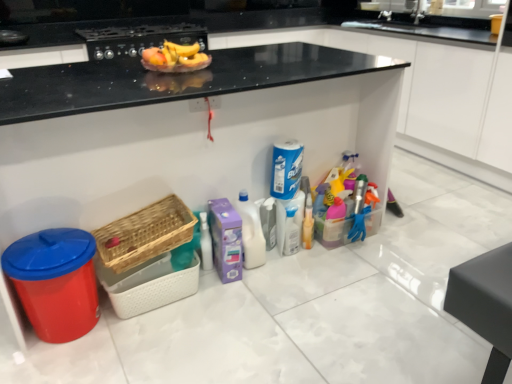
Question: Considering the positions of matte black stove at upper center and woven wood basket at lower left, acting as the second basket starting from the top, in the image, is matte black stove at upper center taller or shorter than woven wood basket at lower left, acting as the second basket starting from the top,?

Choices:
 (A) tall
 (B) short

Answer: (A)

Question: In terms of size, does matte black stove at upper center appear bigger or smaller than woven wood basket at lower left, placed as the first basket when sorted from bottom to top?

Choices:
 (A) big
 (B) small

Answer: (A)

Question: Which object is the farthest from the white plastic bottle at center, which appears as the second cleaning product when viewed from the top?

Choices:
 (A) woven wood basket at lower left, placed as the first basket when sorted from bottom to top
 (B) woven wood basket at lower left, which is counted as the second basket, starting from the bottom
 (C) shiny plastic bowl at upper center
 (D) matte black stove at upper center
 (E) blue glossy spray can at center, marked as the 2th cleaning product in a left-to-right arrangement

Answer: (D)

Question: Estimate the real-world distances between objects in this image. Which object is farther from the white plastic bottle at center, which ranks as the first cleaning product in bottom-to-top order?

Choices:
 (A) woven wood basket at lower left, placed as the first basket when sorted from bottom to top
 (B) blue glossy spray can at center, placed as the first cleaning product when sorted from top to bottom
 (C) woven wood basket at lower left, which is counted as the second basket, starting from the bottom
 (D) shiny plastic bowl at upper center
 (E) matte black stove at upper center

Answer: (E)